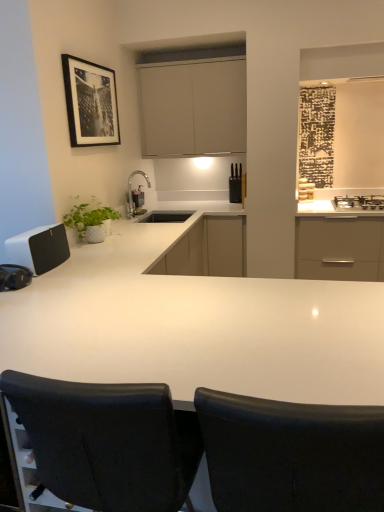
The width and height of the screenshot is (384, 512). What are the coordinates of `green matte plant at left` in the screenshot? It's located at (88, 215).

Locate an element on the screen. This screenshot has height=512, width=384. white matte cabinet at center, the 1th cabinetry ordered from the bottom is located at coordinates (207, 249).

Measure the distance between point [113,134] and camera.

Point [113,134] and camera are 3.18 meters apart from each other.

What is the approximate width of black leather chair at center, which is the 2th chair from left to right?

The width of black leather chair at center, which is the 2th chair from left to right, is 20.70 inches.

Measure the distance between point (235, 497) and camera.

The distance of point (235, 497) from camera is 88.80 centimeters.

The image size is (384, 512). I want to click on matte white cabinet at upper center, which appears as the 2th cabinetry when ordered from the bottom, so click(x=193, y=108).

I want to click on black plastic knife block at upper center, the 1th appliance from the top, so click(x=235, y=184).

The height and width of the screenshot is (512, 384). What are the coordinates of `green matte plant at left` in the screenshot? It's located at (88, 215).

Which of these two, black framed print at upper left or matte white cabinet at upper center, the first cabinetry from the top, stands taller?

With more height is matte white cabinet at upper center, the first cabinetry from the top.

Is matte white cabinet at upper center, the first cabinetry from the top, located within black framed print at upper left?

No, matte white cabinet at upper center, the first cabinetry from the top, is not surrounded by black framed print at upper left.

Is black framed print at upper left oriented towards matte white cabinet at upper center, the first cabinetry from the top?

No.

From the image's perspective, which object appears higher, black framed print at upper left or matte white cabinet at upper center, which appears as the 2th cabinetry when ordered from the bottom?

matte white cabinet at upper center, which appears as the 2th cabinetry when ordered from the bottom, is shown above in the image.

Is black glass gas stove at upper right aimed at matte white cabinet at upper center, the first cabinetry from the top?

No.

In terms of size, does black glass gas stove at upper right appear bigger or smaller than matte white cabinet at upper center, the first cabinetry from the top?

black glass gas stove at upper right is smaller than matte white cabinet at upper center, the first cabinetry from the top.

Is black glass gas stove at upper right wider or thinner than matte white cabinet at upper center, the first cabinetry from the top?

Considering their sizes, black glass gas stove at upper right looks broader than matte white cabinet at upper center, the first cabinetry from the top.

In terms of width, does white glossy countertop at center look wider or thinner when compared to black framed print at upper left?

white glossy countertop at center is wider than black framed print at upper left.

Between point (238, 344) and point (70, 124), which one is positioned behind?

Positioned behind is point (70, 124).

From a real-world perspective, which is physically below, white glossy countertop at center or black framed print at upper left?

white glossy countertop at center is physically lower.

Is black framed print at upper left at the back of white glossy countertop at center?

No, white glossy countertop at center is not facing the opposite direction of black framed print at upper left.

How many degrees apart are the facing directions of green matte plant at left and satin nickel faucet at center?

The facing directions of green matte plant at left and satin nickel faucet at center are 1.32 degrees apart.

How far apart are green matte plant at left and satin nickel faucet at center?

The distance of green matte plant at left from satin nickel faucet at center is 28.69 inches.

Who is smaller, green matte plant at left or satin nickel faucet at center?

satin nickel faucet at center is smaller.

From the image's perspective, between green matte plant at left and satin nickel faucet at center, which one is located above?

satin nickel faucet at center.

Is white matte cabinet at center, the 1th cabinetry ordered from the bottom, located outside black leather chair at center, which is the 2th chair from left to right?

Indeed, white matte cabinet at center, the 1th cabinetry ordered from the bottom, is completely outside black leather chair at center, which is the 2th chair from left to right.

How many degrees apart are the facing directions of white matte cabinet at center, the 2th cabinetry in the top-to-bottom sequence, and black leather chair at center, which is the 2th chair from left to right?

178 degrees separate the facing orientations of white matte cabinet at center, the 2th cabinetry in the top-to-bottom sequence, and black leather chair at center, which is the 2th chair from left to right.

Which cabinetry is the 2nd one when counting from the back of the black leather chair at center, which ranks as the first chair in right-to-left order? Please provide its 2D coordinates.

[(207, 249)]

Does white matte cabinet at center, the 2th cabinetry in the top-to-bottom sequence, turn towards black leather chair at center, which ranks as the first chair in right-to-left order?

Yes, white matte cabinet at center, the 2th cabinetry in the top-to-bottom sequence, is oriented towards black leather chair at center, which ranks as the first chair in right-to-left order.

Between point (25, 256) and point (236, 172), which one is positioned in front?

Point (25, 256)

Which of these two, white matte speaker at left, which appears as the first appliance when viewed from the left, or black plastic knife block at upper center, marked as the 2th appliance in a bottom-to-top arrangement, is bigger?

With larger size is white matte speaker at left, which appears as the first appliance when viewed from the left.

Is white matte speaker at left, acting as the 1th appliance starting from the front, facing towards black plastic knife block at upper center, marked as the 2th appliance in a bottom-to-top arrangement?

No, white matte speaker at left, acting as the 1th appliance starting from the front, is not oriented towards black plastic knife block at upper center, marked as the 2th appliance in a bottom-to-top arrangement.

Can you confirm if white matte speaker at left, which appears as the first appliance when viewed from the left, is thinner than black plastic knife block at upper center, the second appliance positioned from the left?

Incorrect, the width of white matte speaker at left, which appears as the first appliance when viewed from the left, is not less than that of black plastic knife block at upper center, the second appliance positioned from the left.

Between green matte plant at left and black plastic knife block at upper center, the 1th appliance from the top, which one has smaller size?

black plastic knife block at upper center, the 1th appliance from the top, is smaller.

Is green matte plant at left in contact with black plastic knife block at upper center, which is counted as the 2th appliance, starting from the front?

There is a gap between green matte plant at left and black plastic knife block at upper center, which is counted as the 2th appliance, starting from the front.

Is green matte plant at left completely or partially outside of black plastic knife block at upper center, the second appliance positioned from the left?

Yes, green matte plant at left is outside of black plastic knife block at upper center, the second appliance positioned from the left.

Visually, is green matte plant at left positioned to the left or to the right of black plastic knife block at upper center, the second appliance positioned from the left?

green matte plant at left is to the left of black plastic knife block at upper center, the second appliance positioned from the left.

Identify the location of the 1st cabinetry behind the black framed print at upper left. The image size is (384, 512). (193, 108).

You are a GUI agent. You are given a task and a screenshot of the screen. Output one action in this format:
    pyautogui.click(x=<x>, y=<y>)
    Task: Click on the cabinetry above the black glass gas stove at upper right (from the image's perspective)
    The image size is (384, 512).
    Given the screenshot: What is the action you would take?
    pyautogui.click(x=193, y=108)

Based on their spatial positions, is black leather chair at center, which ranks as the first chair in right-to-left order, or satin nickel faucet at center further from matte white cabinet at upper center, the first cabinetry from the top?

Among the two, black leather chair at center, which ranks as the first chair in right-to-left order, is located further to matte white cabinet at upper center, the first cabinetry from the top.

From the image, which object appears to be farther from black glass gas stove at upper right, black plastic knife block at upper center, arranged as the 1th appliance when viewed from the right, or white matte cabinet at center, the 2th cabinetry in the top-to-bottom sequence?

white matte cabinet at center, the 2th cabinetry in the top-to-bottom sequence.

Which object lies nearer to the anchor point satin nickel faucet at center, black leather chair at center, which ranks as the first chair in right-to-left order, or white glossy countertop at center?

white glossy countertop at center is closer to satin nickel faucet at center.

Based on the photo, looking at the image, which one is located closer to green matte plant at left, black leather chair at center, which ranks as the first chair in right-to-left order, or white matte speaker at left, arranged as the 2th appliance when viewed from the right?

Based on the image, white matte speaker at left, arranged as the 2th appliance when viewed from the right, appears to be nearer to green matte plant at left.

Which object lies further to the anchor point green matte plant at left, matte white cabinet at upper center, the first cabinetry from the top, or black framed print at upper left?

Based on the image, matte white cabinet at upper center, the first cabinetry from the top, appears to be further to green matte plant at left.

When comparing their distances from green matte plant at left, does black leather chair at center, which ranks as the first chair in left-to-right order, or white matte speaker at left, placed as the 2th appliance when sorted from top to bottom, seem closer?

The object closer to green matte plant at left is white matte speaker at left, placed as the 2th appliance when sorted from top to bottom.

Estimate the real-world distances between objects in this image. Which object is closer to black leather chair at center, which ranks as the first chair in right-to-left order, white glossy countertop at center or white matte cabinet at center, the 2th cabinetry in the top-to-bottom sequence?

white glossy countertop at center is closer to black leather chair at center, which ranks as the first chair in right-to-left order.

Which object lies further to the anchor point white glossy countertop at center, black glass gas stove at upper right or matte white cabinet at upper center, which appears as the 2th cabinetry when ordered from the bottom?

black glass gas stove at upper right.

Where is `appliance between matte white cabinet at upper center, the first cabinetry from the top, and white matte cabinet at center, the 2th cabinetry in the top-to-bottom sequence, in the up-down direction`? appliance between matte white cabinet at upper center, the first cabinetry from the top, and white matte cabinet at center, the 2th cabinetry in the top-to-bottom sequence, in the up-down direction is located at coordinates (235, 184).

What are the coordinates of `cabinetry between black leather chair at center, which ranks as the first chair in left-to-right order, and white matte cabinet at center, the 1th cabinetry ordered from the bottom, along the z-axis` in the screenshot? It's located at (193, 108).

The image size is (384, 512). I want to click on picture frame between black leather chair at center, which ranks as the first chair in left-to-right order, and black plastic knife block at upper center, the second appliance positioned from the left, from front to back, so click(90, 103).

This screenshot has width=384, height=512. In order to click on plant between white matte speaker at left, arranged as the 2th appliance when viewed from the right, and black plastic knife block at upper center, arranged as the 1th appliance when viewed from the right, along the z-axis in this screenshot , I will do `click(88, 215)`.